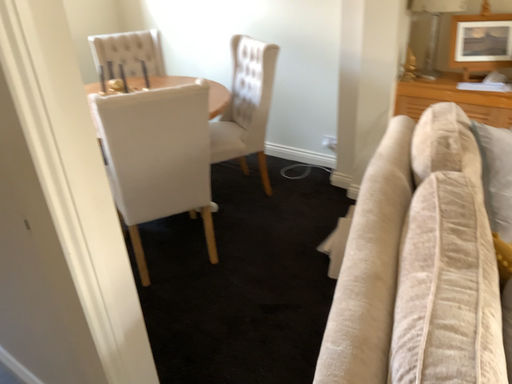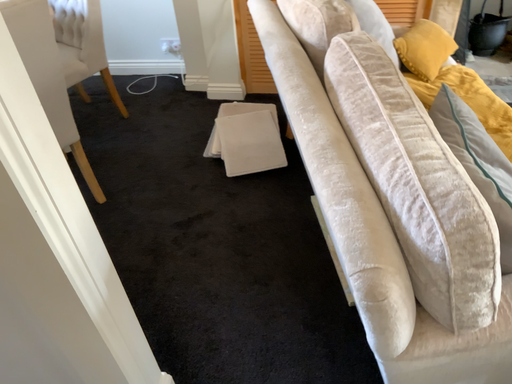
Question: How did the camera likely rotate when shooting the video?

Choices:
 (A) rotated left
 (B) rotated right

Answer: (B)